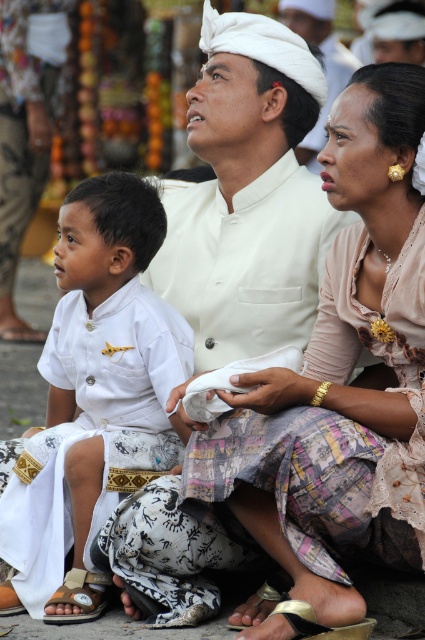
Question: Among these points, which one is farthest from the camera?

Choices:
 (A) (59, 614)
 (B) (385, 237)

Answer: (B)

Question: Which point is farther to the camera?

Choices:
 (A) brown leather sandal at lower left
 (B) white matte shirt at left

Answer: (B)

Question: Can you confirm if white cloth at center is thinner than brown leather sandal at lower left?

Choices:
 (A) no
 (B) yes

Answer: (A)

Question: Among these points, which one is farthest from the camera?

Choices:
 (A) (283, 634)
 (B) (65, 582)

Answer: (B)

Question: Can you confirm if matte white dress at center is positioned to the left of white cloth at center?

Choices:
 (A) yes
 (B) no

Answer: (A)

Question: Is white cloth at center thinner than gold metallic sandal at lower center?

Choices:
 (A) yes
 (B) no

Answer: (B)